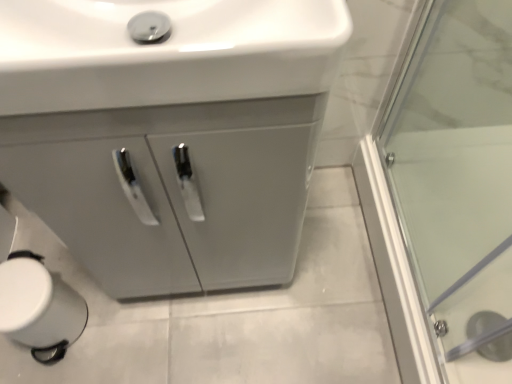
Question: In the image, is white glossy sink at upper center on the left side or the right side of matte gray cabinet at center?

Choices:
 (A) left
 (B) right

Answer: (A)

Question: Considering the positions of point (180, 21) and point (254, 249), is point (180, 21) closer or farther from the camera than point (254, 249)?

Choices:
 (A) closer
 (B) farther

Answer: (A)

Question: Do you think white glossy sink at upper center is within matte gray cabinet at center, or outside of it?

Choices:
 (A) inside
 (B) outside

Answer: (A)

Question: From a real-world perspective, relative to white glossy sink at upper center, is matte gray cabinet at center vertically above or below?

Choices:
 (A) below
 (B) above

Answer: (A)

Question: In terms of height, does matte gray cabinet at center look taller or shorter compared to white glossy sink at upper center?

Choices:
 (A) tall
 (B) short

Answer: (A)

Question: In terms of width, does matte gray cabinet at center look wider or thinner when compared to white glossy sink at upper center?

Choices:
 (A) thin
 (B) wide

Answer: (B)

Question: Based on their sizes in the image, would you say matte gray cabinet at center is bigger or smaller than white glossy sink at upper center?

Choices:
 (A) big
 (B) small

Answer: (A)